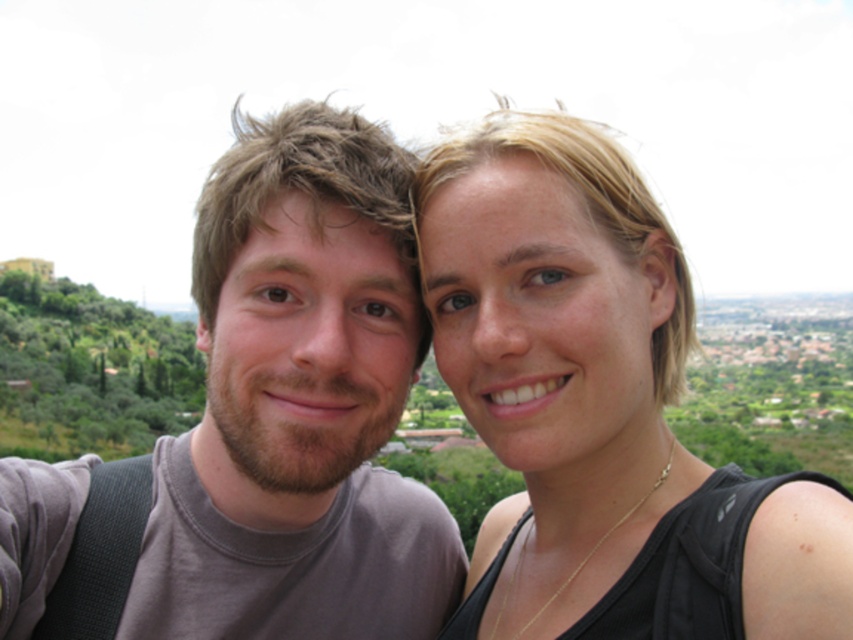
You are a photographer trying to capture a closeup of the matte black tank top at center in the image. The camera you are using has a focal length of 50mm. Given that the point at coordinates (601, 408) is where the tank top is located, what is the best way to frame the shot to ensure the entire matte black tank top at center is in the frame?

The matte black tank top at center is located at point (601, 408). To ensure the entire matte black tank top at center is in the frame, position the camera so that the center of the viewfinder aligns with the coordinates (601, 408). Using a 50mm focal length should provide a natural field of view to capture the subject without distortion.